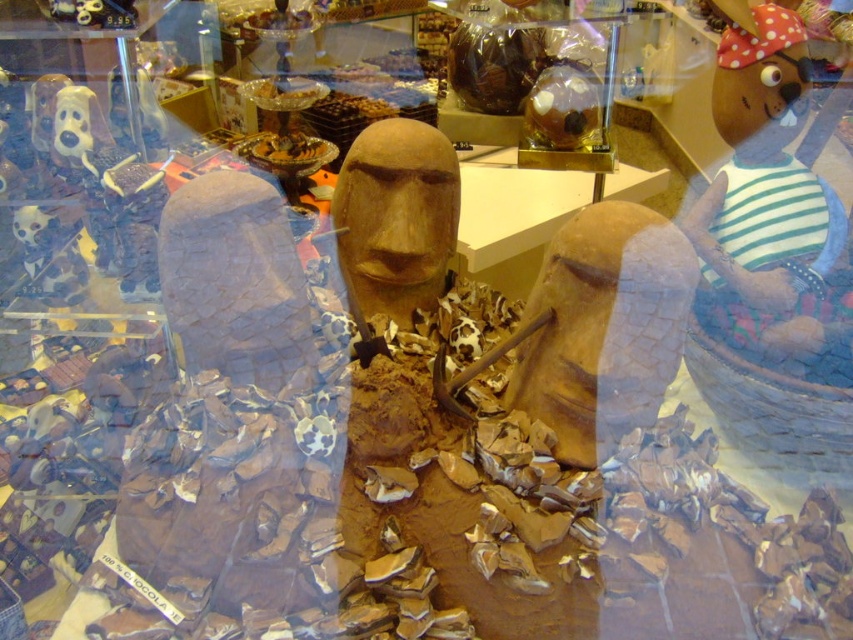
You are a customer in a chocolate shop and see the striped fabric bear at upper right and the matte brown statue at center. Which object is located above the other?

The striped fabric bear at upper right is positioned over matte brown statue at center.

You are a delivery person who needs to place a new item in the display case. The new item requires a space that is at least 60 centimeters away from the matte brown statue at center. Can the space near the striped fabric bear at upper right accommodate this requirement?

The distance between the striped fabric bear at upper right and the matte brown statue at center is 58.22 centimeters, which is less than the required 60 centimeters. Therefore, the space near the striped fabric bear at upper right is too close to place the new item there.